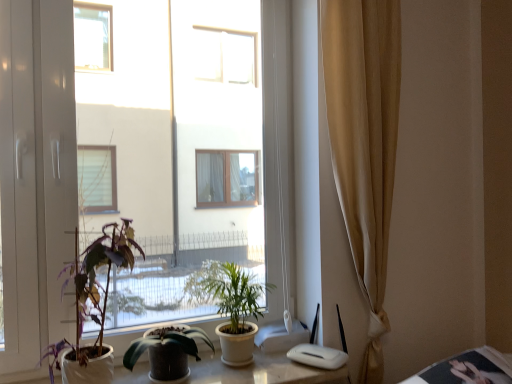
Question: From a real-world perspective, is green leafy plant at center, which ranks as the 1th houseplant in right-to-left order, on top of transparent glass window at center?

Choices:
 (A) yes
 (B) no

Answer: (B)

Question: Does green leafy plant at center, which ranks as the 1th houseplant in right-to-left order, have a greater width compared to transparent glass window at center?

Choices:
 (A) yes
 (B) no

Answer: (A)

Question: Considering the relative positions of green leafy plant at center, which ranks as the 1th houseplant in right-to-left order, and transparent glass window at center in the image provided, is green leafy plant at center, which ranks as the 1th houseplant in right-to-left order, to the left of transparent glass window at center from the viewer's perspective?

Choices:
 (A) yes
 (B) no

Answer: (B)

Question: Considering the relative sizes of green leafy plant at center, which ranks as the 1th houseplant in right-to-left order, and transparent glass window at center in the image provided, is green leafy plant at center, which ranks as the 1th houseplant in right-to-left order, smaller than transparent glass window at center?

Choices:
 (A) no
 (B) yes

Answer: (B)

Question: Is green leafy plant at center, which ranks as the 1th houseplant in right-to-left order, not close to transparent glass window at center?

Choices:
 (A) yes
 (B) no

Answer: (B)

Question: Looking at their shapes, would you say beige fabric curtain at right is wider or thinner than green leafy plant at center, which ranks as the 1th houseplant in right-to-left order?

Choices:
 (A) wide
 (B) thin

Answer: (B)

Question: In terms of size, does beige fabric curtain at right appear bigger or smaller than green leafy plant at center, arranged as the 3th houseplant when viewed from the left?

Choices:
 (A) big
 (B) small

Answer: (A)

Question: From a real-world perspective, is beige fabric curtain at right physically located above or below green leafy plant at center, which ranks as the 1th houseplant in right-to-left order?

Choices:
 (A) below
 (B) above

Answer: (B)

Question: Which is correct: beige fabric curtain at right is inside green leafy plant at center, which ranks as the 1th houseplant in right-to-left order, or outside of it?

Choices:
 (A) outside
 (B) inside

Answer: (A)

Question: Is green leafy plant at center, which ranks as the 1th houseplant in right-to-left order, bigger or smaller than green glossy plant at center, placed as the second houseplant when sorted from right to left?

Choices:
 (A) big
 (B) small

Answer: (A)

Question: Is point (227, 344) closer or farther from the camera than point (143, 334)?

Choices:
 (A) farther
 (B) closer

Answer: (A)

Question: Considering their positions, is green leafy plant at center, arranged as the 3th houseplant when viewed from the left, located in front of or behind green glossy plant at center, placed as the second houseplant when sorted from right to left?

Choices:
 (A) behind
 (B) front

Answer: (A)

Question: From a real-world perspective, is green leafy plant at center, which ranks as the 1th houseplant in right-to-left order, physically located above or below green glossy plant at center, placed as the second houseplant when sorted from right to left?

Choices:
 (A) below
 (B) above

Answer: (B)

Question: Is point (45, 56) positioned closer to the camera than point (358, 233)?

Choices:
 (A) farther
 (B) closer

Answer: (B)

Question: Considering the positions of transparent glass window at center and beige fabric curtain at right in the image, is transparent glass window at center taller or shorter than beige fabric curtain at right?

Choices:
 (A) short
 (B) tall

Answer: (A)